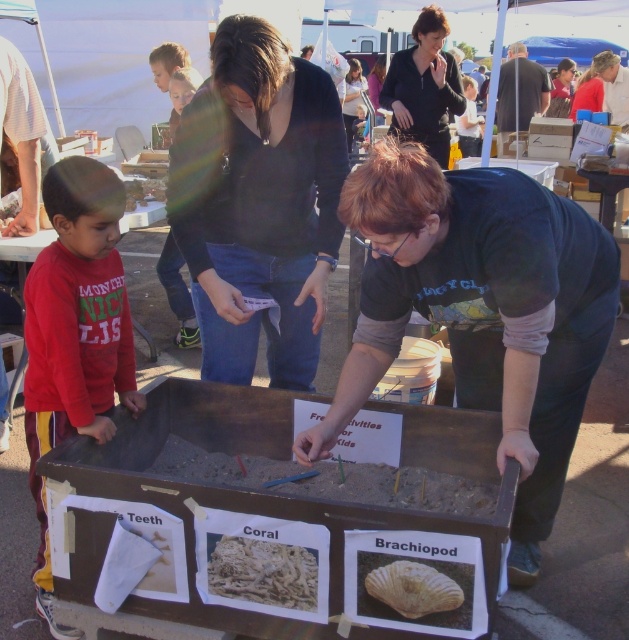
Can you confirm if black matte jacket at upper center is thinner than black shirt at center?

Correct, black matte jacket at upper center's width is less than black shirt at center's.

Can you confirm if black matte jacket at upper center is smaller than black shirt at center?

Yes, black matte jacket at upper center is smaller than black shirt at center.

Is point (391, 100) positioned before point (504, 140)?

Yes, it is.

Where is `black matte jacket at upper center`? The height and width of the screenshot is (640, 629). black matte jacket at upper center is located at coordinates (425, 86).

Which of these two, red cotton shirt at left or smooth beige shell at center, stands taller?

red cotton shirt at left

Can you confirm if red cotton shirt at left is shorter than smooth beige shell at center?

No.

Who is more forward, [106,252] or [455,589]?

Point [455,589]

Locate an element on the screen. red cotton shirt at left is located at coordinates (75, 333).

Does dark blue shirt at center have a smaller size compared to white coral at center?

Incorrect, dark blue shirt at center is not smaller in size than white coral at center.

Where is `dark blue shirt at center`? This screenshot has height=640, width=629. dark blue shirt at center is located at coordinates click(481, 310).

This screenshot has width=629, height=640. In order to click on dark blue shirt at center in this screenshot , I will do `click(481, 310)`.